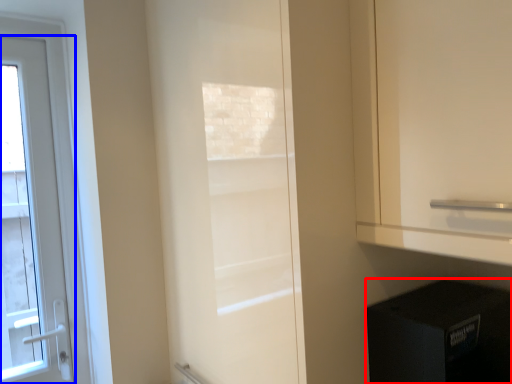
Question: Which point is further to the camera, appliance (highlighted by a red box) or door (highlighted by a blue box)?

Choices:
 (A) appliance
 (B) door

Answer: (B)